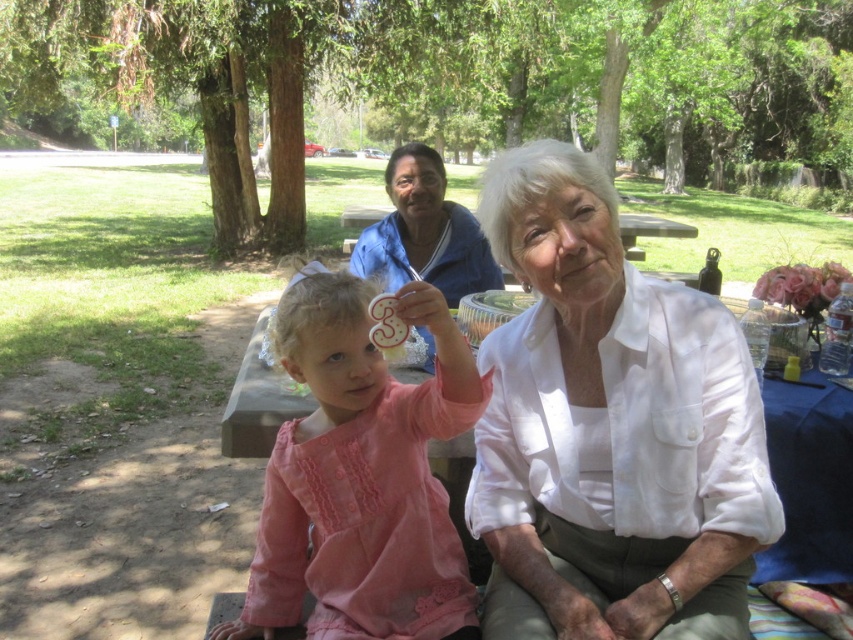
The height and width of the screenshot is (640, 853). What do you see at coordinates (361, 476) in the screenshot?
I see `pink fabric dress at center` at bounding box center [361, 476].

How far apart are pink fabric dress at center and white cotton shirt at center?

pink fabric dress at center and white cotton shirt at center are 1.61 meters apart from each other.

Who is more distant from viewer, (445, 604) or (434, 195)?

The point (434, 195) is behind.

Locate an element on the screen. pink fabric dress at center is located at coordinates (361, 476).

Is white cotton blouse at center below pink fabric dress at center?

Actually, white cotton blouse at center is above pink fabric dress at center.

How distant is white cotton blouse at center from pink fabric dress at center?

10.80 inches

Which is behind, point (595, 362) or point (364, 612)?

Point (364, 612)

This screenshot has height=640, width=853. In order to click on white cotton blouse at center in this screenshot , I will do `click(608, 428)`.

Is point (647, 333) closer to camera compared to point (393, 280)?

Yes, point (647, 333) is in front of point (393, 280).

In the scene shown: Who is more forward, (572, 180) or (397, 170)?

Point (572, 180)

From the picture: Who is more forward, (618, 499) or (480, 289)?

Positioned in front is point (618, 499).

The height and width of the screenshot is (640, 853). Find the location of `white cotton blouse at center`. white cotton blouse at center is located at coordinates (608, 428).